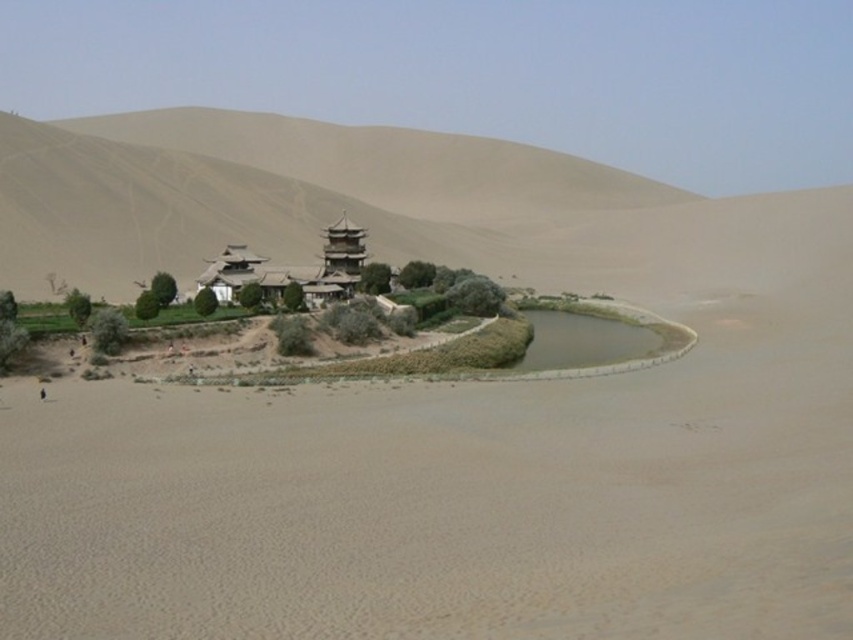
Identify the location of desert sand at center. (479, 472).

Can you confirm if desert sand at center is positioned to the right of sandy beige hill at center?

Yes, desert sand at center is to the right of sandy beige hill at center.

Which is in front, point (126, 481) or point (90, 204)?

Point (126, 481)

Locate an element on the screen. The image size is (853, 640). desert sand at center is located at coordinates (479, 472).